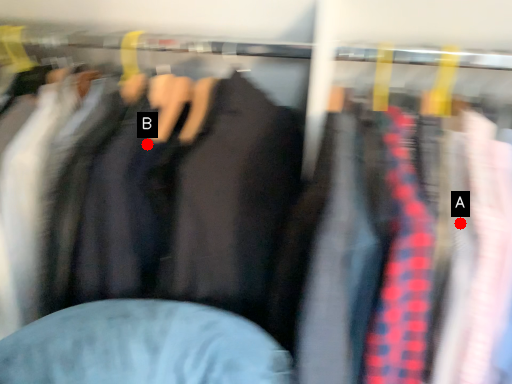
Question: Two points are circled on the image, labeled by A and B beside each circle. Which point is farther to the camera?

Choices:
 (A) A is further
 (B) B is further

Answer: (B)